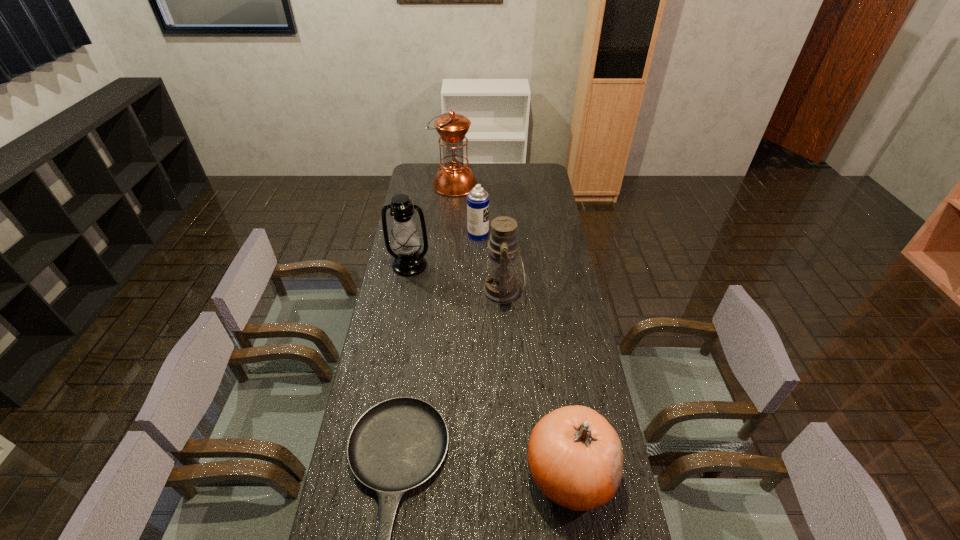
The height and width of the screenshot is (540, 960). In order to click on object at the right edge in this screenshot , I will do `click(575, 456)`.

You are a GUI agent. You are given a task and a screenshot of the screen. Output one action in this format:
    pyautogui.click(x=<x>, y=<y>)
    Task: Click on the object located at the far left corner
    The width and height of the screenshot is (960, 540).
    Given the screenshot: What is the action you would take?
    pyautogui.click(x=454, y=179)

Where is `vacant region at the left edge of the desktop`? This screenshot has height=540, width=960. vacant region at the left edge of the desktop is located at coordinates (404, 294).

The width and height of the screenshot is (960, 540). Identify the location of vacant space at the right edge. (579, 319).

Where is `unoccupied position between the pumpkin and the tallest oil lamp`? unoccupied position between the pumpkin and the tallest oil lamp is located at coordinates point(513,328).

At what (x,y) coordinates should I click in order to perform the action: click on vacant space that's between the rightmost oil lamp and the pumpkin. Please return your answer as a coordinate pair (x, y). Looking at the image, I should click on (537, 381).

Where is `free space between the pumpkin and the farthest object`? Image resolution: width=960 pixels, height=540 pixels. free space between the pumpkin and the farthest object is located at coordinates tap(513, 328).

At what (x,y) coordinates should I click in order to perform the action: click on vacant space that is in between the rightmost oil lamp and the pumpkin. Please return your answer as a coordinate pair (x, y). The height and width of the screenshot is (540, 960). Looking at the image, I should click on (537, 381).

Locate which object is the closest to the frying pan. Please provide its 2D coordinates. Your answer should be formatted as a tuple, i.e. [(x, y)], where the tuple contains the x and y coordinates of a point satisfying the conditions above.

[(575, 456)]

Find the location of `the closest object to the shortest object`. the closest object to the shortest object is located at coordinates (575, 456).